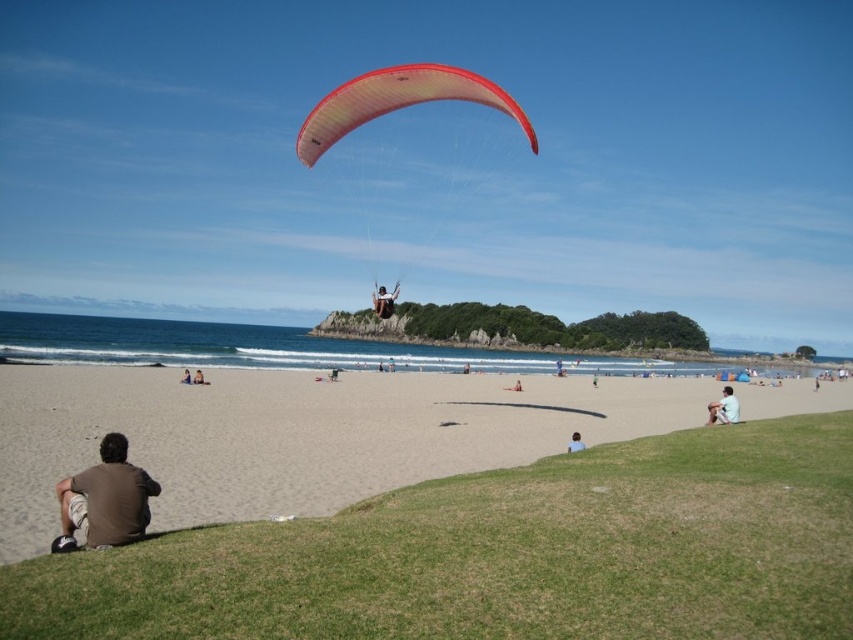
Question: Considering the real-world distances, which object is closest to the matte yellow paraglider at center?

Choices:
 (A) beige sand at lower center
 (B) blue denim shorts at center
 (C) white cotton shirt at lower right

Answer: (A)

Question: Which point appears farthest from the camera in this image?

Choices:
 (A) (122, 520)
 (B) (186, 371)
 (C) (393, 68)

Answer: (B)

Question: Is brown cotton shirt at lower left smaller than blue denim shorts at center?

Choices:
 (A) no
 (B) yes

Answer: (A)

Question: Can you confirm if white cotton shirt at lower right is positioned to the right of blue fabric person at lower center?

Choices:
 (A) no
 (B) yes

Answer: (B)

Question: Which point is farther to the camera?

Choices:
 (A) matte black backpack at center
 (B) blue denim shorts at center

Answer: (B)

Question: Is matte yellow paraglider at center bigger than white cotton shirt at lower right?

Choices:
 (A) yes
 (B) no

Answer: (A)